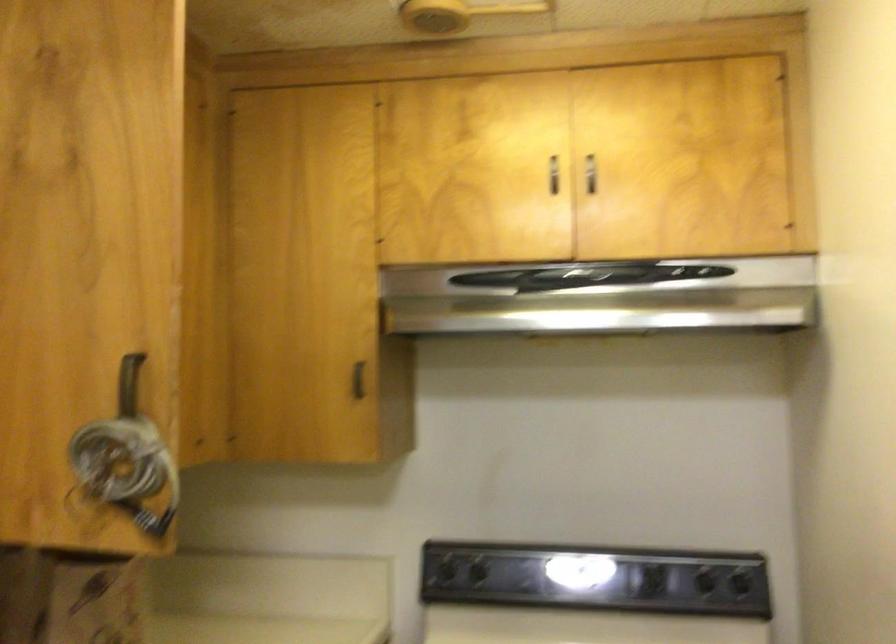
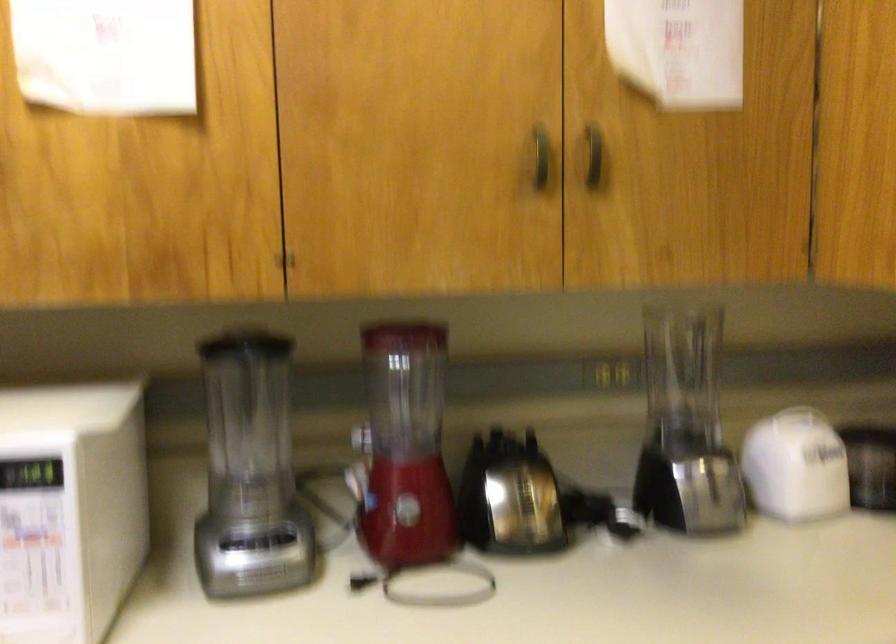
Question: How did the camera likely rotate?

Choices:
 (A) Left
 (B) Right
 (C) Up
 (D) Down

Answer: (A)